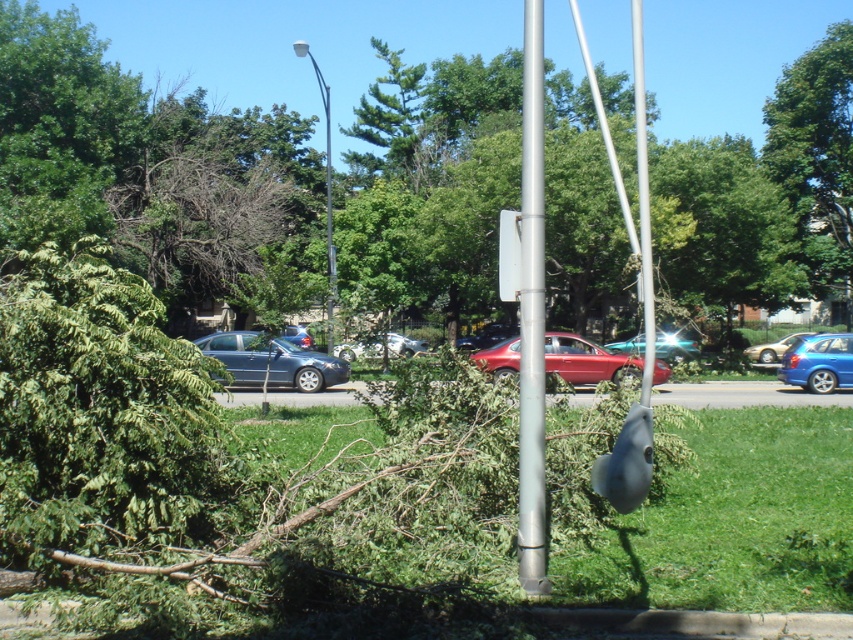
Question: Can you confirm if green leafy tree at left is bigger than green leafy tree at upper right?

Choices:
 (A) yes
 (B) no

Answer: (B)

Question: Which of these objects is positioned farthest from the matte red sedan at center?

Choices:
 (A) silver metallic flag pole at center
 (B) white glossy streetlight at upper center
 (C) blue metallic hatchback at right
 (D) metallic blue car at center

Answer: (B)

Question: Which point is closer to the camera taking this photo?

Choices:
 (A) (532, 465)
 (B) (753, 356)
 (C) (630, 358)
 (D) (814, 376)

Answer: (A)

Question: Which object is closer to the camera taking this photo?

Choices:
 (A) white glossy streetlight at upper center
 (B) green leafy tree at upper right
 (C) metallic blue car at center

Answer: (C)

Question: From the image, what is the correct spatial relationship of green leafy tree at upper right in relation to metallic blue car at center?

Choices:
 (A) right
 (B) left

Answer: (A)

Question: Does green leafy tree at left appear on the right side of green leafy tree at upper right?

Choices:
 (A) no
 (B) yes

Answer: (A)